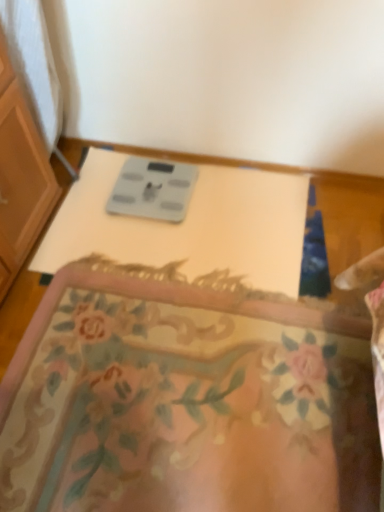
Question: Is floral carpet at center bigger or smaller than gray plastic scale at center?

Choices:
 (A) big
 (B) small

Answer: (A)

Question: Is point (29, 386) positioned closer to the camera than point (228, 224)?

Choices:
 (A) closer
 (B) farther

Answer: (A)

Question: Which object is the closest to the floral carpet at center?

Choices:
 (A) gray plastic scale at center
 (B) gray matte scale at center

Answer: (A)

Question: Based on their relative distances, which object is nearer to the gray matte scale at center?

Choices:
 (A) floral carpet at center
 (B) gray plastic scale at center

Answer: (B)